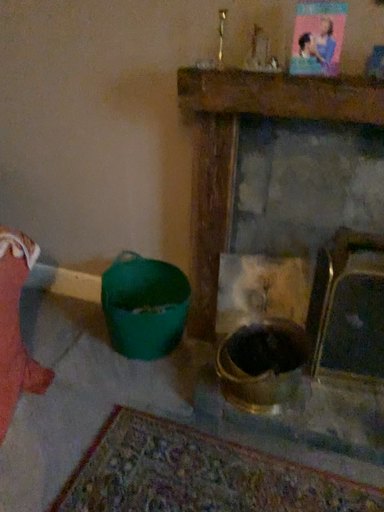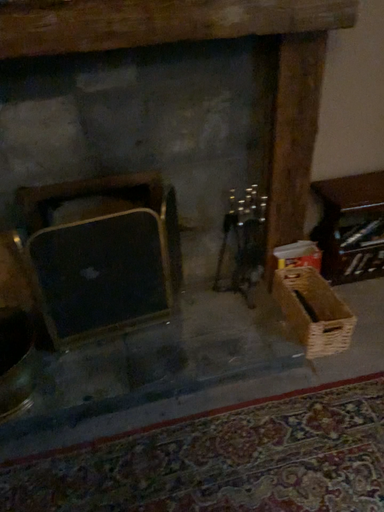
Question: Which way did the camera rotate in the video?

Choices:
 (A) rotated right
 (B) rotated left

Answer: (A)